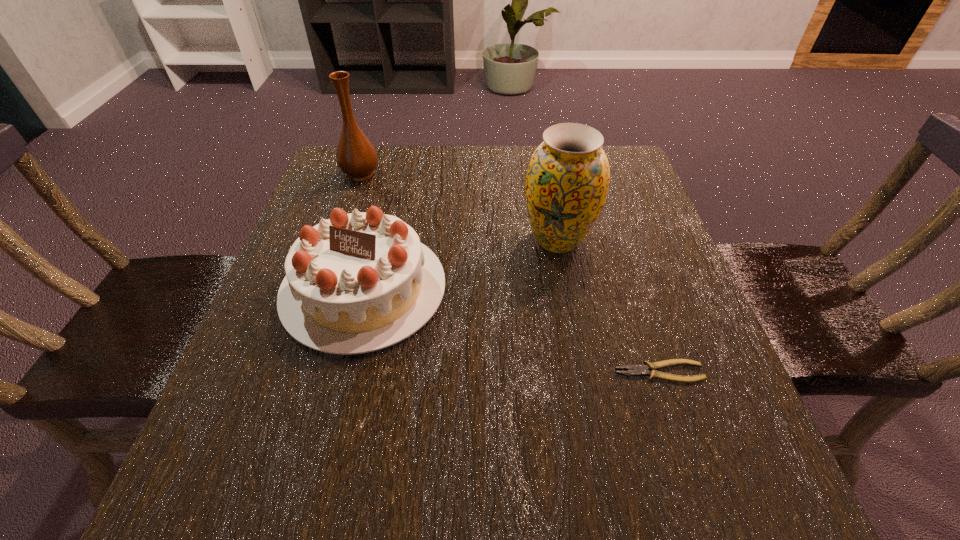
This screenshot has width=960, height=540. In order to click on the left vase in this screenshot , I will do 356,157.

I want to click on the farther vase, so click(356, 157).

Identify the location of the nearer vase. (567, 181).

Identify the location of birthday cake. This screenshot has height=540, width=960. (360, 282).

The image size is (960, 540). I want to click on the shortest object, so click(636, 370).

Identify the location of the nearest object. (636, 370).

Identify the location of vacant space situated on the front of the farthest object. The height and width of the screenshot is (540, 960). (337, 246).

Identify the location of free space located on the front of the right vase. The image size is (960, 540). (571, 312).

Identify the location of vacant region located on the front of the birthday cake. The height and width of the screenshot is (540, 960). (310, 508).

Where is `free space located 0.210m on the left of the shortest object`? Image resolution: width=960 pixels, height=540 pixels. free space located 0.210m on the left of the shortest object is located at coordinates (485, 372).